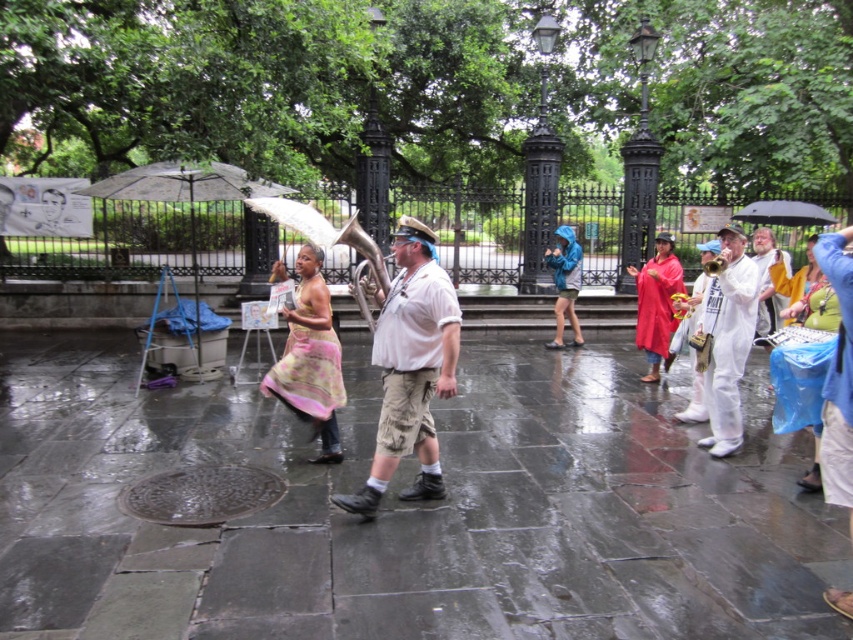
Is the position of dark gray stone pavement at center more distant than that of rubber poncho at center?

No, it is not.

Does dark gray stone pavement at center have a greater width compared to rubber poncho at center?

No, dark gray stone pavement at center is not wider than rubber poncho at center.

Find the location of `dark gray stone pavement at center`. dark gray stone pavement at center is located at coordinates (409, 509).

Where is `dark gray stone pavement at center`? The width and height of the screenshot is (853, 640). dark gray stone pavement at center is located at coordinates (409, 509).

Does blue plastic bag at right appear under blue waterproof poncho at center?

Indeed, blue plastic bag at right is positioned under blue waterproof poncho at center.

Between blue plastic bag at right and blue waterproof poncho at center, which one appears on the left side from the viewer's perspective?

Positioned to the left is blue waterproof poncho at center.

Is point (793, 332) positioned in front of point (575, 241)?

Yes.

Image resolution: width=853 pixels, height=640 pixels. In order to click on blue plastic bag at right in this screenshot , I will do `click(799, 396)`.

Is white cotton shirt at center wider than blue plastic bag at right?

No, white cotton shirt at center is not wider than blue plastic bag at right.

Which of these two, white cotton shirt at center or blue plastic bag at right, stands taller?

Standing taller between the two is white cotton shirt at center.

At what (x,y) coordinates should I click in order to perform the action: click on white cotton shirt at center. Please return your answer as a coordinate pair (x, y). Looking at the image, I should click on (410, 369).